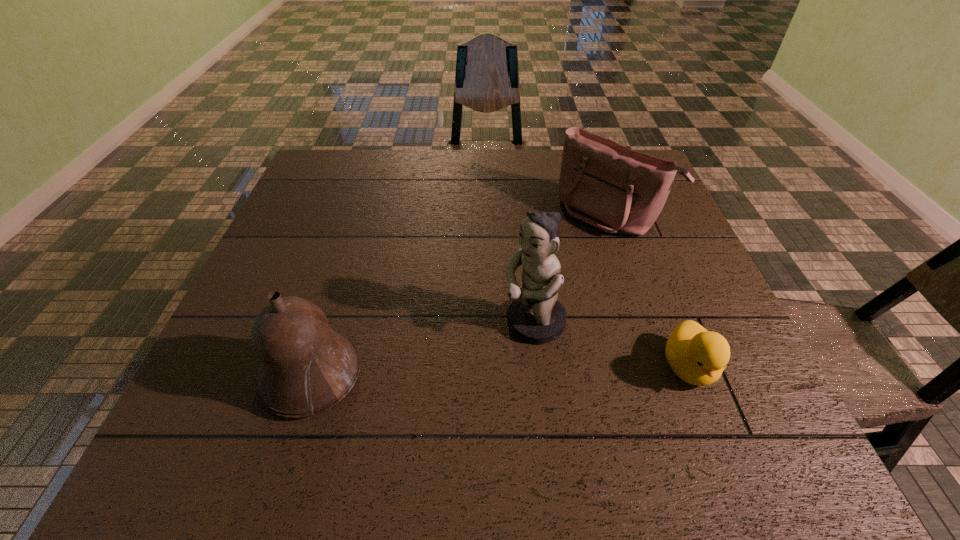
You are a GUI agent. You are given a task and a screenshot of the screen. Output one action in this format:
    pyautogui.click(x=<x>, y=<y>)
    Task: Click on the free space that is in between the bell and the duck
    The image size is (960, 540).
    Given the screenshot: What is the action you would take?
    pyautogui.click(x=500, y=372)

Image resolution: width=960 pixels, height=540 pixels. In order to click on free point between the shortest object and the bell in this screenshot , I will do `click(500, 372)`.

This screenshot has width=960, height=540. I want to click on free spot between the third object from right to left and the farthest object, so tap(571, 268).

Locate an element on the screen. This screenshot has width=960, height=540. free space that is in between the bell and the figurine is located at coordinates (423, 349).

You are a GUI agent. You are given a task and a screenshot of the screen. Output one action in this format:
    pyautogui.click(x=<x>, y=<y>)
    Task: Click on the empty space between the duck and the farthest object
    The height and width of the screenshot is (540, 960).
    Given the screenshot: What is the action you would take?
    pos(649,291)

Where is `vacant space in between the shoulder bag and the figurine`? This screenshot has height=540, width=960. vacant space in between the shoulder bag and the figurine is located at coordinates [571, 268].

You are a GUI agent. You are given a task and a screenshot of the screen. Output one action in this format:
    pyautogui.click(x=<x>, y=<y>)
    Task: Click on the free space that is in between the bell and the duck
    
    Given the screenshot: What is the action you would take?
    pyautogui.click(x=500, y=372)

In order to click on object identified as the third closest to the farthest object in this screenshot , I will do `click(305, 368)`.

Identify which object is located as the third nearest to the leftmost object. Please provide its 2D coordinates. Your answer should be formatted as a tuple, i.e. [(x, y)], where the tuple contains the x and y coordinates of a point satisfying the conditions above.

[(697, 356)]

Where is `free spot that satisfies the following two spatial constraints: 1. on the back side of the shoulder bag; 2. on the left side of the figurine`? The height and width of the screenshot is (540, 960). free spot that satisfies the following two spatial constraints: 1. on the back side of the shoulder bag; 2. on the left side of the figurine is located at coordinates (522, 214).